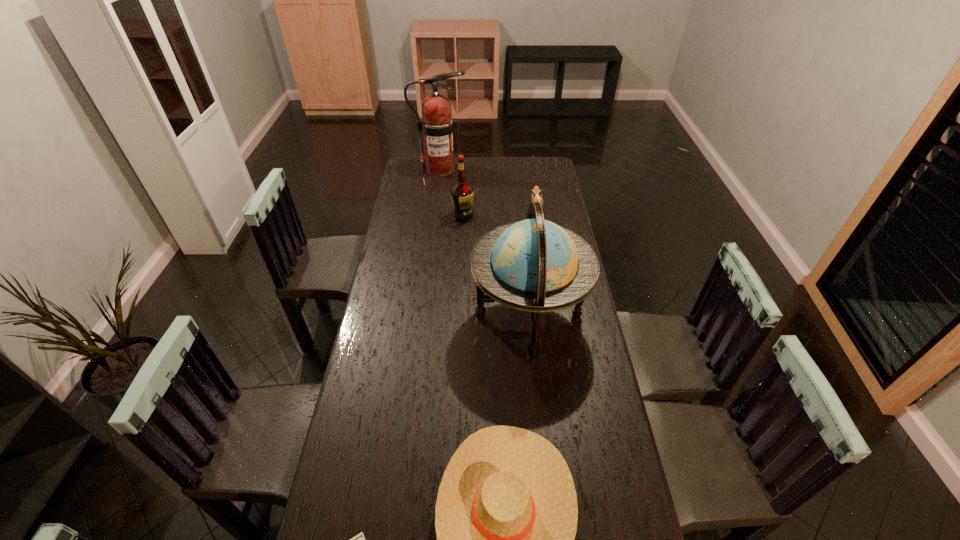
Locate an element on the screen. The image size is (960, 540). the farthest object is located at coordinates (437, 124).

Identify the location of the third nearest object. (534, 265).

You are a GUI agent. You are given a task and a screenshot of the screen. Output one action in this format:
    pyautogui.click(x=<x>, y=<y>)
    Task: Click on the alcohol
    
    Given the screenshot: What is the action you would take?
    pyautogui.click(x=462, y=193)

The image size is (960, 540). Find the location of `the fifth tallest object`. the fifth tallest object is located at coordinates (537, 198).

Where is `free location located at the nozzle of the fire extinguisher`? The width and height of the screenshot is (960, 540). free location located at the nozzle of the fire extinguisher is located at coordinates [511, 168].

The width and height of the screenshot is (960, 540). In order to click on free spot located 0.160m on the surface of the third nearest object in this screenshot , I will do `click(427, 316)`.

Find the location of `vacant space located on the surface of the third nearest object`. vacant space located on the surface of the third nearest object is located at coordinates (452, 316).

In order to click on vacant space located 0.300m on the surface of the third nearest object in this screenshot , I will do `click(388, 316)`.

Locate an element on the screen. free space located on the label of the fourth shortest object is located at coordinates (462, 247).

This screenshot has height=540, width=960. Identify the location of vacant space located at the beak of the fifth tallest object. (491, 207).